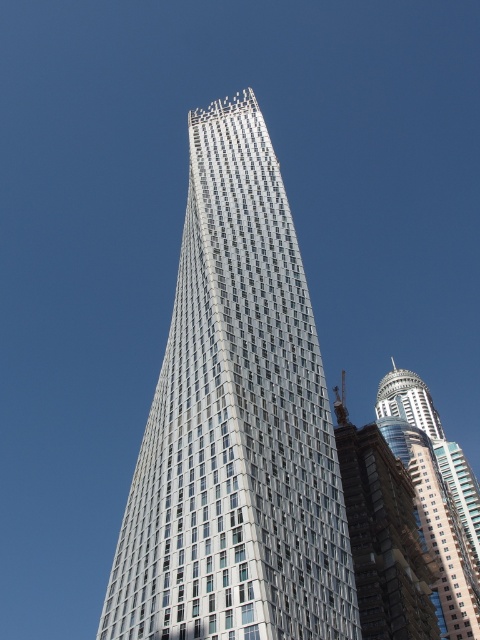
Is point (120, 586) positioned in front of point (469, 528)?

Yes, it is.

Does metallic glass tower at center appear over shiny glass skyscraper at right?

Yes, metallic glass tower at center is above shiny glass skyscraper at right.

Describe the element at coordinates (236, 424) in the screenshot. This screenshot has height=640, width=480. I see `metallic glass tower at center` at that location.

This screenshot has width=480, height=640. I want to click on metallic glass tower at center, so click(x=236, y=424).